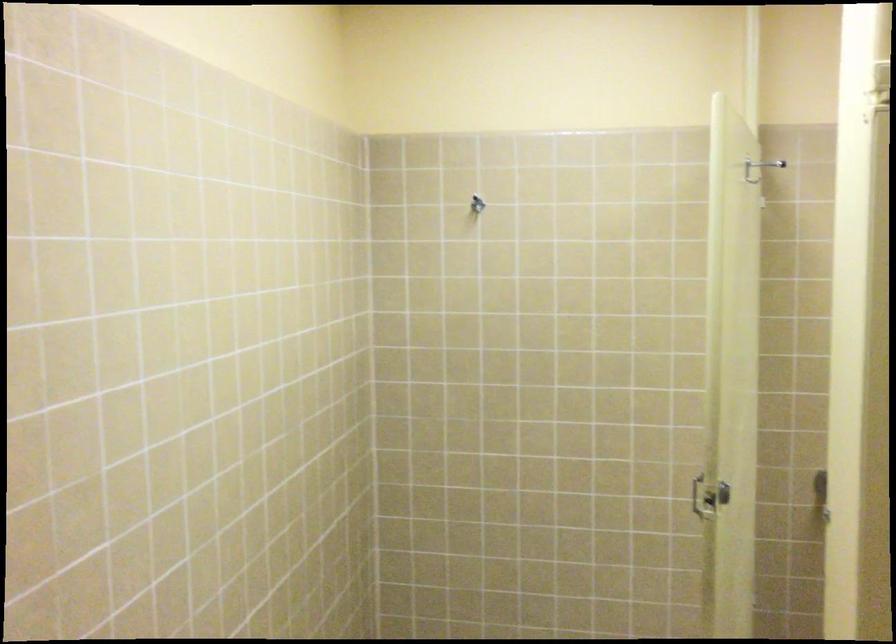
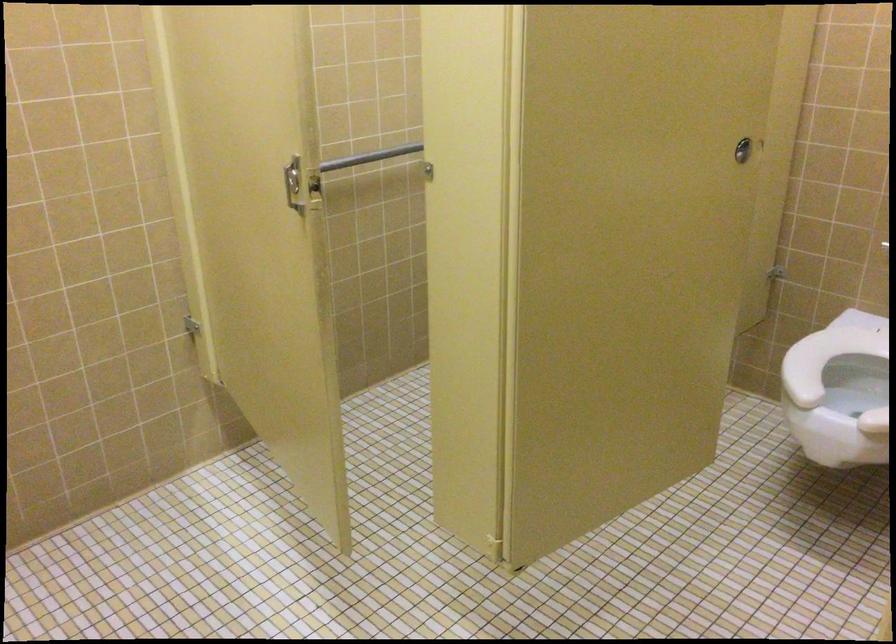
The point at (702,469) is marked in the first image. Where is the corresponding point in the second image?

(293, 184)